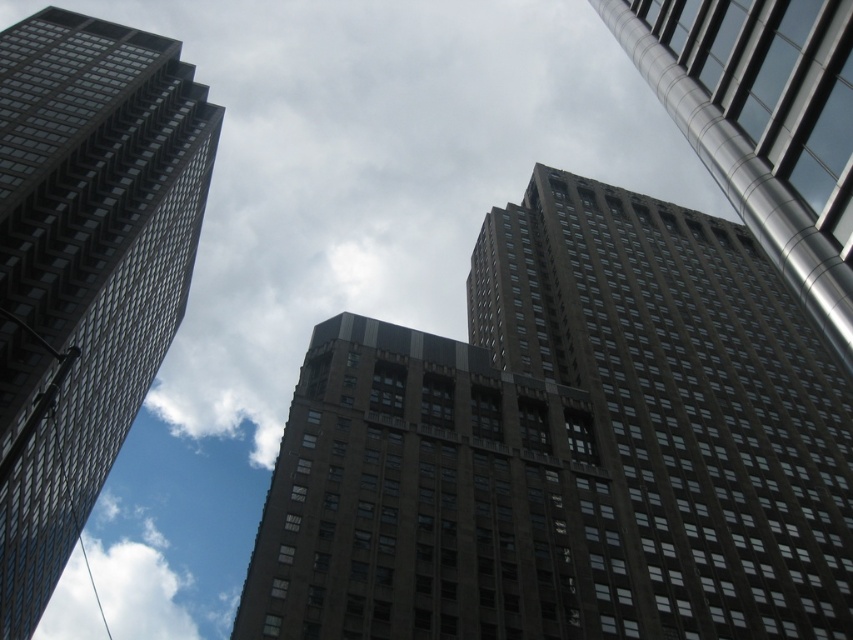
Is matte glass skyscraper at left to the left of white fluffy cloud at lower left from the viewer's perspective?

In fact, matte glass skyscraper at left is to the right of white fluffy cloud at lower left.

Can you confirm if matte glass skyscraper at left is positioned above white fluffy cloud at lower left?

Yes.

Between point (90, 113) and point (158, 588), which one is positioned in front?

Point (90, 113)

Find the location of a particular element. matte glass skyscraper at left is located at coordinates (85, 268).

Who is higher up, white fluffy cloud at upper center or matte glass skyscraper at left?

white fluffy cloud at upper center

Can you confirm if white fluffy cloud at upper center is positioned below matte glass skyscraper at left?

No, white fluffy cloud at upper center is not below matte glass skyscraper at left.

The height and width of the screenshot is (640, 853). Identify the location of white fluffy cloud at upper center. (375, 170).

Identify the location of white fluffy cloud at upper center. This screenshot has width=853, height=640. (375, 170).

Locate an element on the screen. The width and height of the screenshot is (853, 640). matte glass skyscraper at left is located at coordinates (85, 268).

Measure the distance between point (68, 170) and camera.

Point (68, 170) and camera are 101.83 meters apart from each other.

Find the location of a particular element. matte glass skyscraper at left is located at coordinates (85, 268).